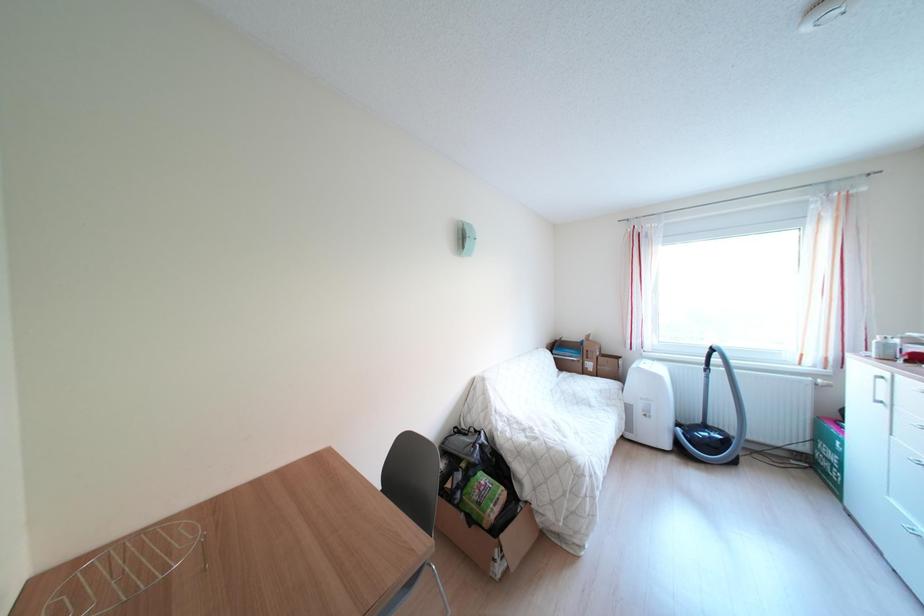
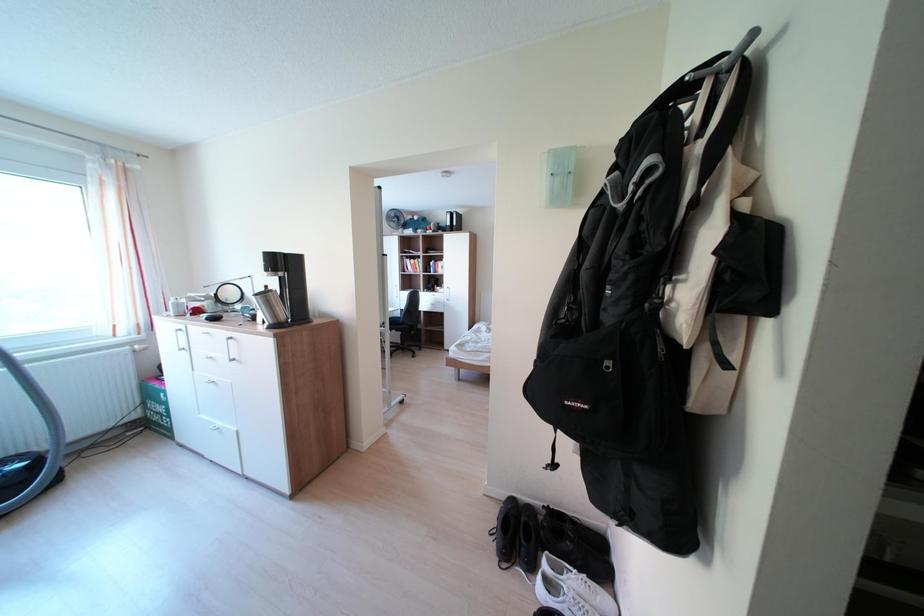
Question: The images are taken continuously from a first-person perspective. In which direction is your viewpoint rotating?

Choices:
 (A) Left
 (B) Right
 (C) Up
 (D) Down

Answer: (B)